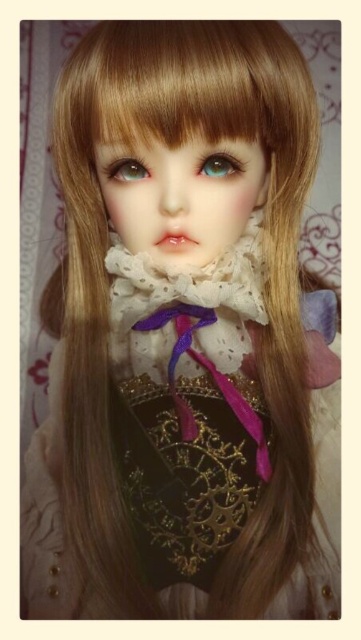
You are a photographer trying to capture a closeup of the doll. The camera lens is 27.85 inches away from the teal glossy eye at center. Will the lens touch the doll when taking the photo?

The distance between the teal glossy eye at center and the viewer is 27.85 inches, so the camera lens will not touch the doll when taking the photo since it is positioned exactly at that distance without any obstruction.

The doll has two eyes. The teal glossy eye at center and the green matte eye at center. Which one is located above the other?

The teal glossy eye at center is positioned over the green matte eye at center.

You are an artist examining the doll and want to paint a symmetrical design on both of its eyes. Considering the teal glossy eye at center and the green matte eye at center, which eye requires a larger canvas area vertically to maintain symmetry?

The teal glossy eye at center requires a larger canvas area vertically because it has a greater height compared to the green matte eye at center.